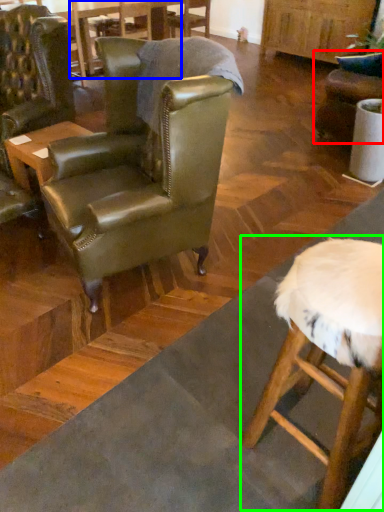
Question: Which is farther away from chair (highlighted by a red box)? table (highlighted by a blue box) or bar stool (highlighted by a green box)?

Choices:
 (A) table
 (B) bar stool

Answer: (B)